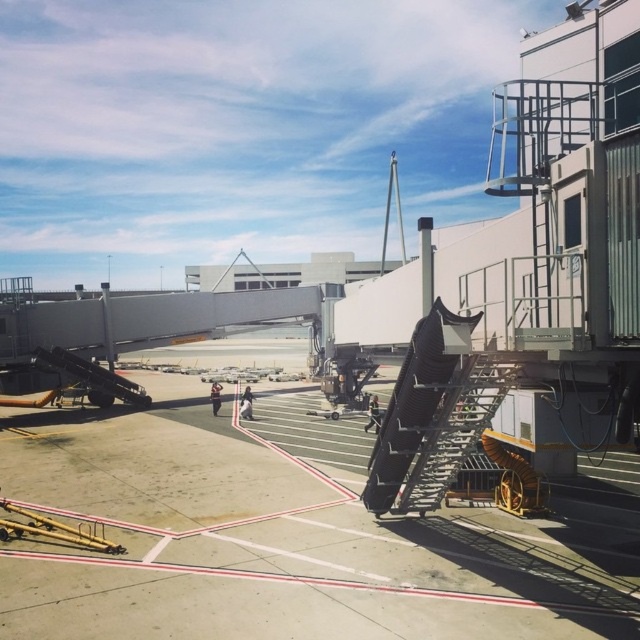
Between point (216, 602) and point (460, 464), which one is positioned in front?

Point (216, 602) is in front.

Is point (554, 518) more distant than point (456, 468)?

That is True.

Identify the location of metallic gray tarmac at center. pos(285,538).

The width and height of the screenshot is (640, 640). In order to click on metallic gray tarmac at center in this screenshot , I will do `click(285, 538)`.